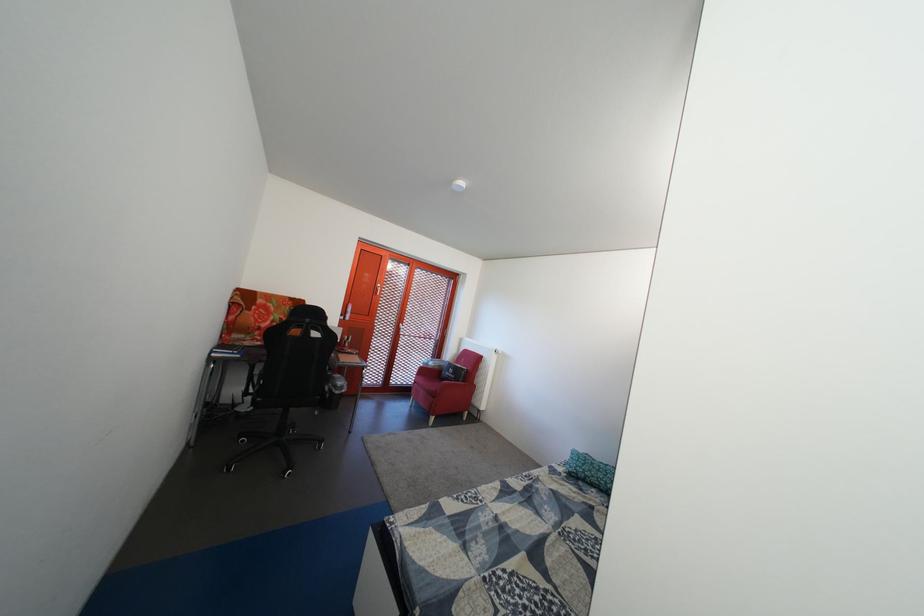
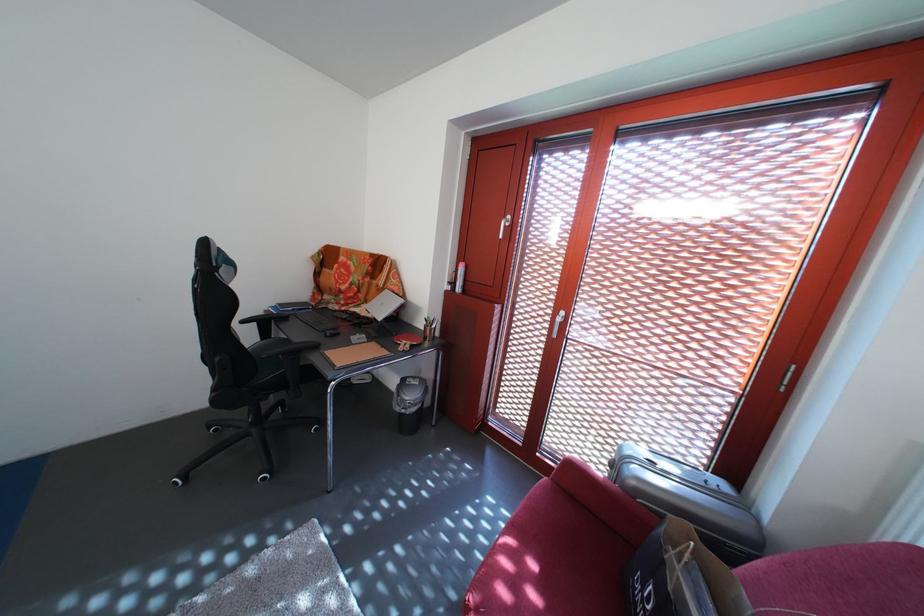
Find the pixel in the second image that matches the point at 348,399 in the first image.

(408, 416)